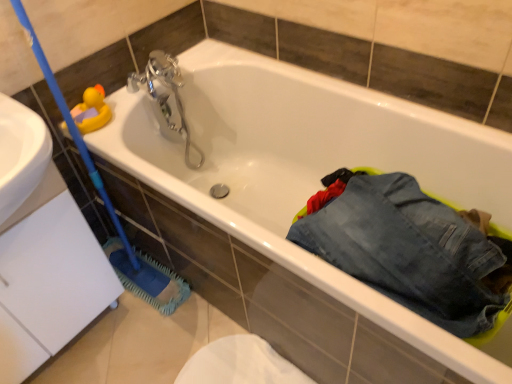
Question: Is silver metallic faucet at upper center turned away from denim pants at lower right?

Choices:
 (A) yes
 (B) no

Answer: (B)

Question: Does silver metallic faucet at upper center lie in front of denim pants at lower right?

Choices:
 (A) yes
 (B) no

Answer: (B)

Question: Is silver metallic faucet at upper center with denim pants at lower right?

Choices:
 (A) yes
 (B) no

Answer: (B)

Question: Is silver metallic faucet at upper center smaller than denim pants at lower right?

Choices:
 (A) no
 (B) yes

Answer: (B)

Question: Is silver metallic faucet at upper center thinner than denim pants at lower right?

Choices:
 (A) no
 (B) yes

Answer: (B)

Question: Is silver metallic faucet at upper center to the left of denim pants at lower right from the viewer's perspective?

Choices:
 (A) no
 (B) yes

Answer: (B)

Question: Is denim pants at lower right at the right side of blue rubber brush at left?

Choices:
 (A) no
 (B) yes

Answer: (B)

Question: From a real-world perspective, is denim pants at lower right positioned over blue rubber brush at left based on gravity?

Choices:
 (A) no
 (B) yes

Answer: (A)

Question: Considering the relative sizes of denim pants at lower right and blue rubber brush at left in the image provided, is denim pants at lower right bigger than blue rubber brush at left?

Choices:
 (A) no
 (B) yes

Answer: (A)

Question: Does denim pants at lower right have a smaller size compared to blue rubber brush at left?

Choices:
 (A) no
 (B) yes

Answer: (B)

Question: Is denim pants at lower right oriented away from blue rubber brush at left?

Choices:
 (A) no
 (B) yes

Answer: (A)

Question: Is denim pants at lower right thinner than blue rubber brush at left?

Choices:
 (A) yes
 (B) no

Answer: (B)

Question: Does denim pants at lower right lie behind silver metallic faucet at upper center?

Choices:
 (A) no
 (B) yes

Answer: (A)